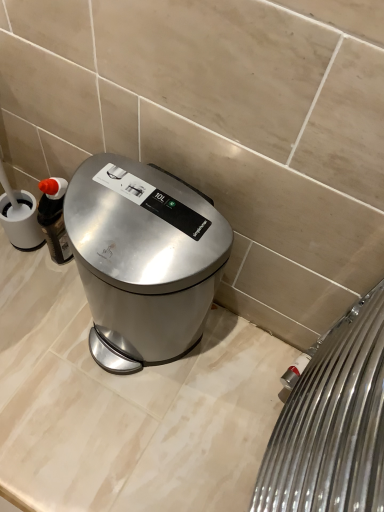
This screenshot has height=512, width=384. I want to click on free space above satin silver trash can at lower left (from a real-world perspective), so click(141, 215).